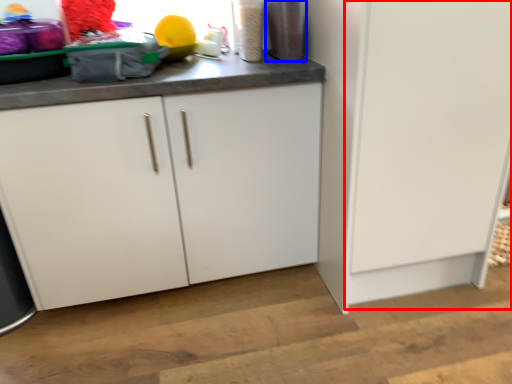
Question: Among these objects, which one is farthest to the camera, door (highlighted by a red box) or appliance (highlighted by a blue box)?

Choices:
 (A) door
 (B) appliance

Answer: (B)